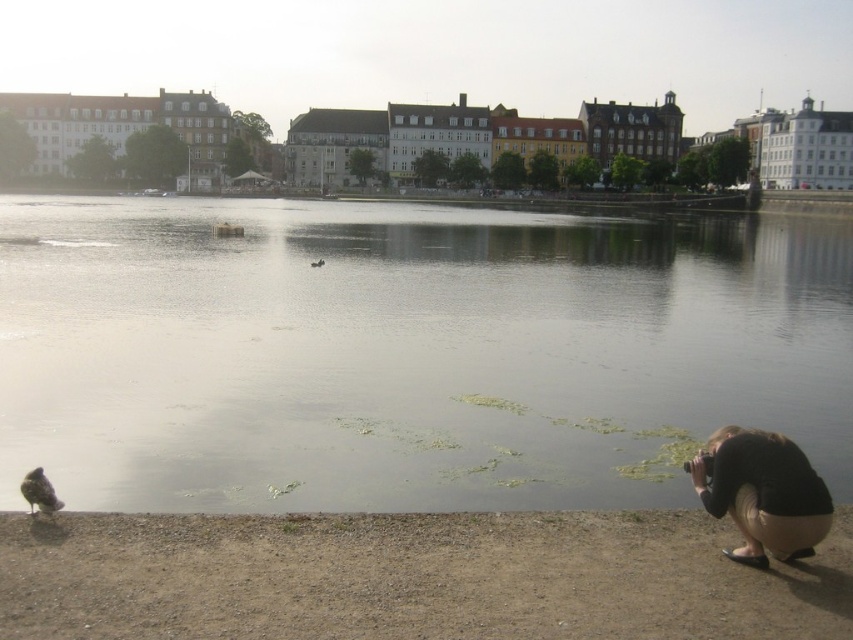
Between point (784, 442) and point (312, 262), which one is positioned behind?

Positioned behind is point (312, 262).

Does point (728, 433) come closer to viewer compared to point (322, 260)?

Yes, it is.

Does point (811, 534) come closer to viewer compared to point (310, 262)?

Yes, point (811, 534) is in front of point (310, 262).

Image resolution: width=853 pixels, height=640 pixels. Find the location of `black fabric squat at lower right`. black fabric squat at lower right is located at coordinates (763, 493).

Can you confirm if black fabric squat at lower right is wider than brown feathered bird at lower left?

Correct, the width of black fabric squat at lower right exceeds that of brown feathered bird at lower left.

Does black fabric squat at lower right appear on the right side of brown feathered bird at lower left?

Yes, black fabric squat at lower right is to the right of brown feathered bird at lower left.

Find the location of a particular element. Image resolution: width=853 pixels, height=640 pixels. black fabric squat at lower right is located at coordinates (763, 493).

Identify the location of black fabric squat at lower right. (763, 493).

What do you see at coordinates (39, 492) in the screenshot?
I see `brown feathered bird at lower left` at bounding box center [39, 492].

Does point (25, 497) lie in front of point (321, 260)?

Yes, it is.

Locate an element on the screen. brown feathered bird at lower left is located at coordinates (39, 492).